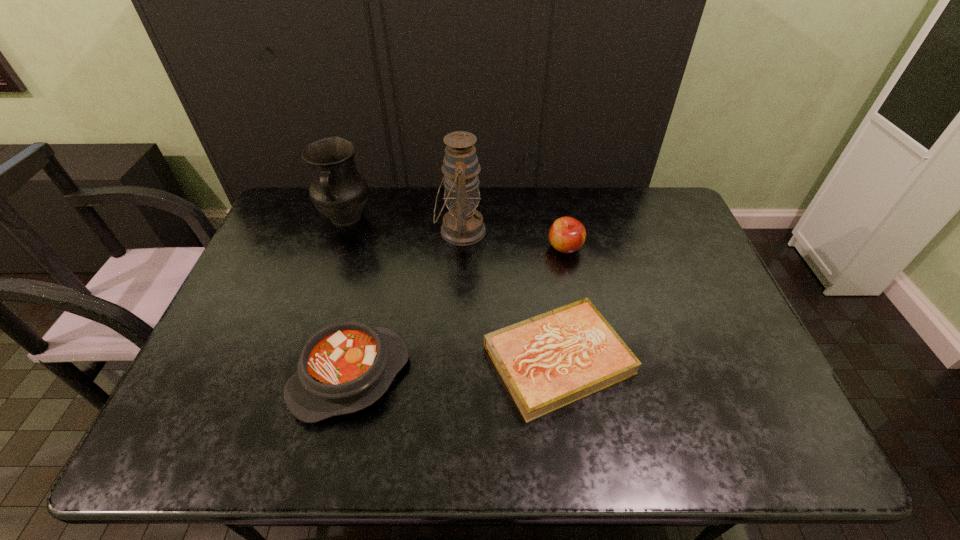
Identify the location of oil lamp that is at the far edge. This screenshot has width=960, height=540. (463, 225).

Locate an element on the screen. Image resolution: width=960 pixels, height=540 pixels. pitcher present at the far edge is located at coordinates (338, 190).

Image resolution: width=960 pixels, height=540 pixels. What are the coordinates of `casserole that is at the near edge` in the screenshot? It's located at (347, 366).

Locate an element on the screen. hardback book positioned at the near edge is located at coordinates (549, 361).

Find the location of a particular element. The image size is (960, 540). object located at the left edge is located at coordinates (338, 190).

Where is `object located at the far left corner`? The width and height of the screenshot is (960, 540). object located at the far left corner is located at coordinates pyautogui.click(x=338, y=190).

Where is `vacant space at the far edge of the desktop`? This screenshot has height=540, width=960. vacant space at the far edge of the desktop is located at coordinates [x=491, y=218].

I want to click on vacant space at the near edge of the desktop, so click(460, 439).

You are a GUI agent. You are given a task and a screenshot of the screen. Output one action in this format:
    pyautogui.click(x=<x>, y=<y>)
    Task: Click on the vacant space at the left edge of the desktop
    
    Given the screenshot: What is the action you would take?
    pyautogui.click(x=243, y=308)

Where is `vacant space at the right edge of the desktop`? This screenshot has width=960, height=540. vacant space at the right edge of the desktop is located at coordinates (673, 232).